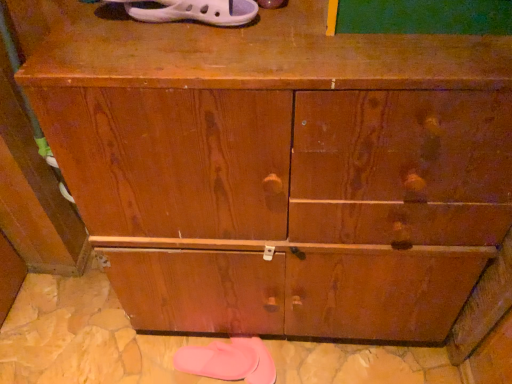
This screenshot has width=512, height=384. What are the coordinates of `vacant space that is to the left of pink rubber slipper at lower center, positioned as the 1th footwear in back-to-front order` in the screenshot? It's located at (152, 356).